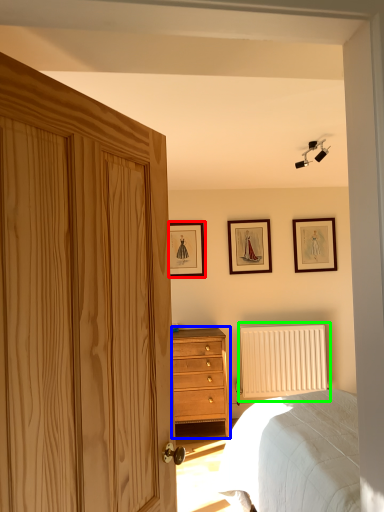
Question: Which object is the farthest from picture frame (highlighted by a red box)? Choose among these: chest of drawers (highlighted by a blue box) or radiator (highlighted by a green box).

Choices:
 (A) chest of drawers
 (B) radiator

Answer: (B)